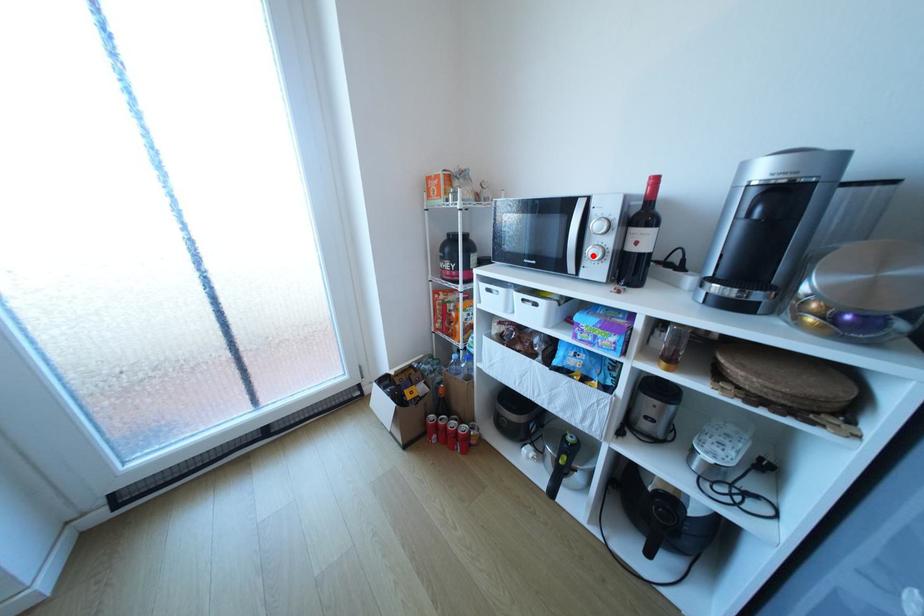
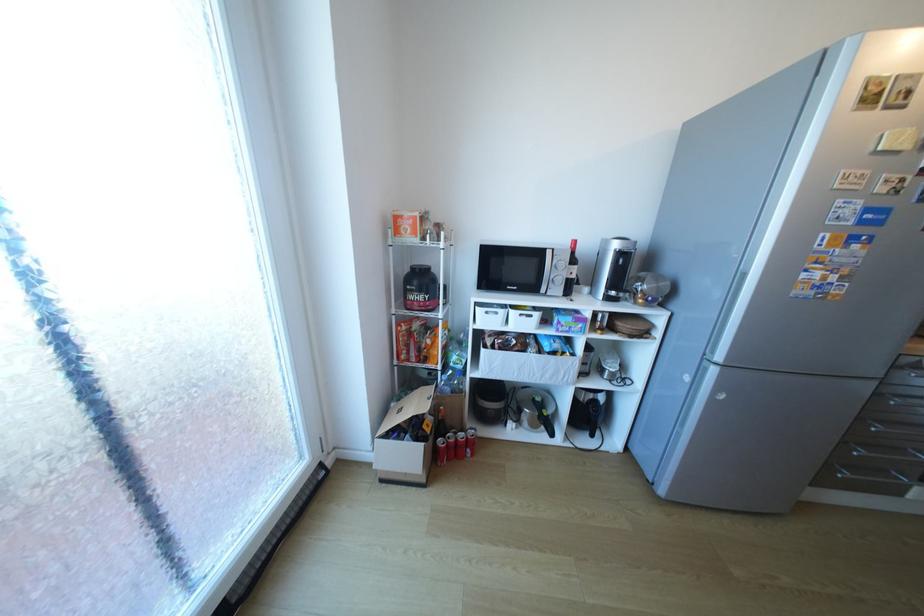
Find the pixel in the second image that matches the highlighted location in the first image.

(560, 282)